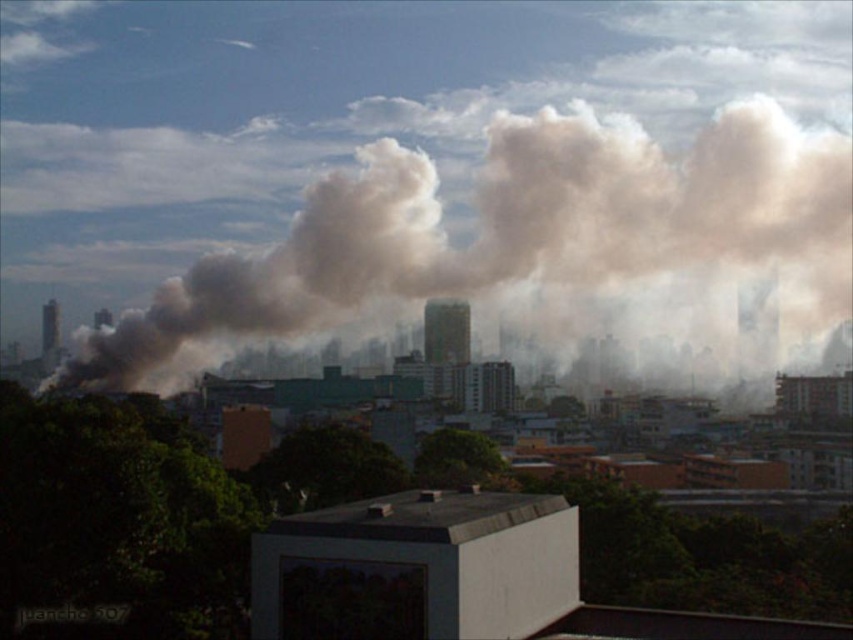
Who is more distant from viewer, (152, 340) or (49, 305)?

Positioned behind is point (49, 305).

Is point (572, 182) in front of point (57, 324)?

Yes, it is in front of point (57, 324).

What do you see at coordinates (511, 230) in the screenshot?
I see `gray smoke at center` at bounding box center [511, 230].

You are a GUI agent. You are given a task and a screenshot of the screen. Output one action in this format:
    pyautogui.click(x=<x>, y=<y>)
    Task: Click on the gray smoke at center
    This screenshot has height=640, width=853.
    Given the screenshot: What is the action you would take?
    pyautogui.click(x=511, y=230)